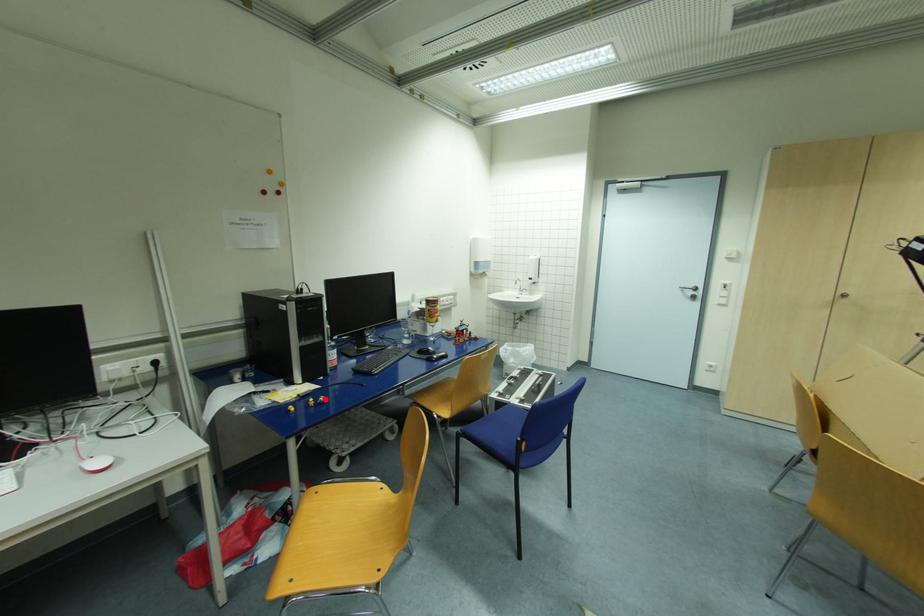
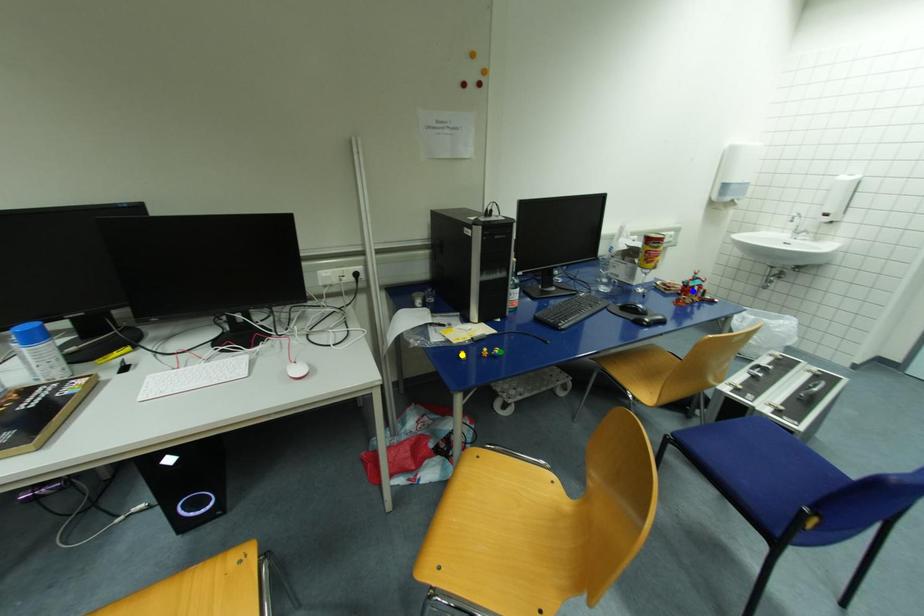
Question: I am providing you with two images of the same scene from different viewpoints. A red point is marked on the first image. You are given multiple points on the second image. Which mark in image 2 goes with the point in image 1?

Choices:
 (A) blue point
 (B) yellow point
 (C) green point

Answer: (C)